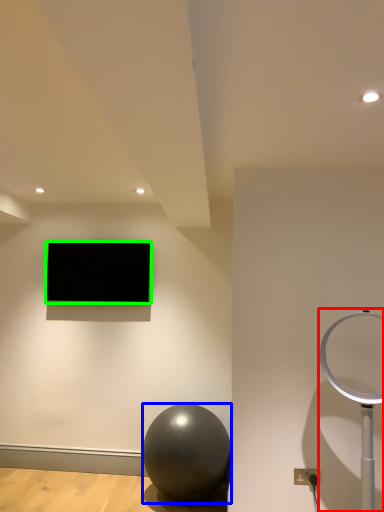
Question: Based on their relative distances, which object is farther from table lamp (highlighted by a red box)? Choose from ball (highlighted by a blue box) and television (highlighted by a green box).

Choices:
 (A) ball
 (B) television

Answer: (B)